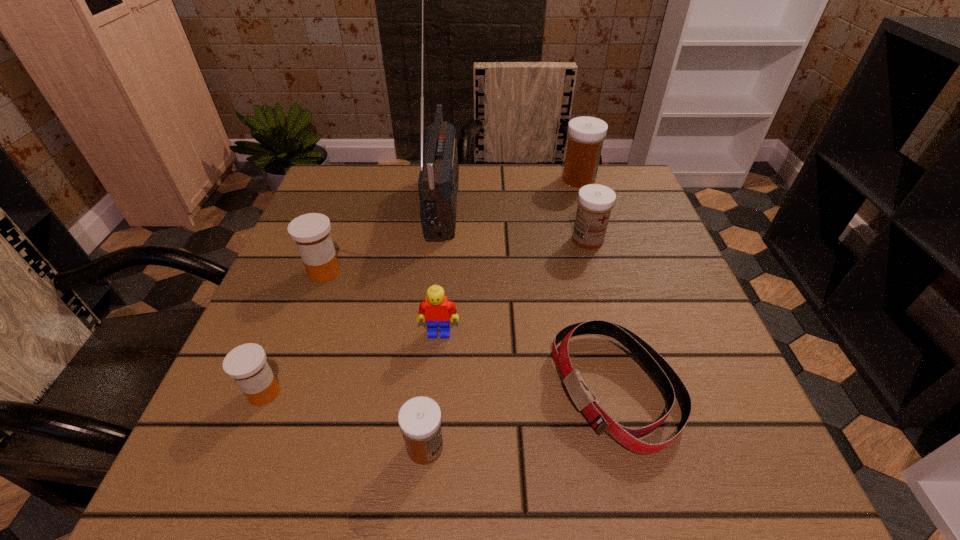
The image size is (960, 540). Identify the location of the leftmost white medicine. (419, 418).

Find the location of a particular element. This screenshot has height=540, width=960. the smallest white medicine is located at coordinates (419, 418).

At what (x,y) coordinates should I click in order to perform the action: click on dog collar. Please return your answer as a coordinate pair (x, y). The image size is (960, 540). Looking at the image, I should click on (670, 383).

Find the location of a particular element. This screenshot has width=960, height=540. the shortest object is located at coordinates (670, 383).

Locate an element on the screen. blank area located 0.350m on the front-facing side of the tallest object is located at coordinates (601, 201).

Where is `vacant space situated 0.190m on the left of the seventh shortest object`? Image resolution: width=960 pixels, height=540 pixels. vacant space situated 0.190m on the left of the seventh shortest object is located at coordinates (489, 179).

Where is `vacant area located 0.120m on the label of the bigger orange medicine`? vacant area located 0.120m on the label of the bigger orange medicine is located at coordinates point(401,272).

The height and width of the screenshot is (540, 960). I want to click on vacant position located on the left of the second nearest white medicine, so click(x=403, y=240).

I want to click on vacant position located 0.160m on the front-facing side of the Lego, so click(x=432, y=424).

Locate an element on the screen. vacant region located 0.060m on the label of the nearer orange medicine is located at coordinates [x=243, y=447].